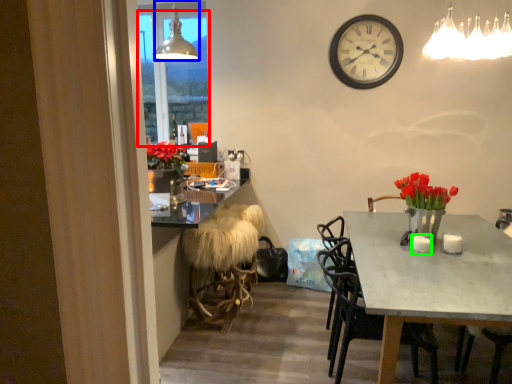
Question: Which object is the farthest from window screen (highlighted by a red box)? Choose among these: lamp (highlighted by a blue box) or coffee cup (highlighted by a green box).

Choices:
 (A) lamp
 (B) coffee cup

Answer: (B)